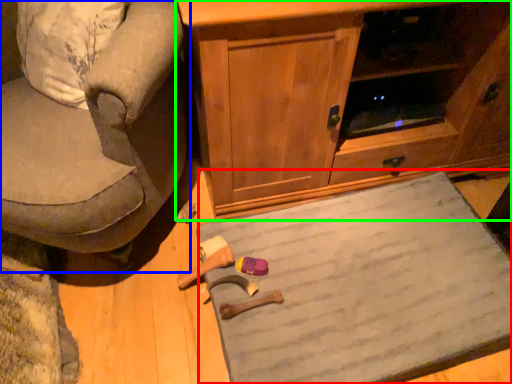
Question: Which is nearer to the doormat (highlighted by a red box)? chair (highlighted by a blue box) or cabinetry (highlighted by a green box).

Choices:
 (A) chair
 (B) cabinetry

Answer: (B)